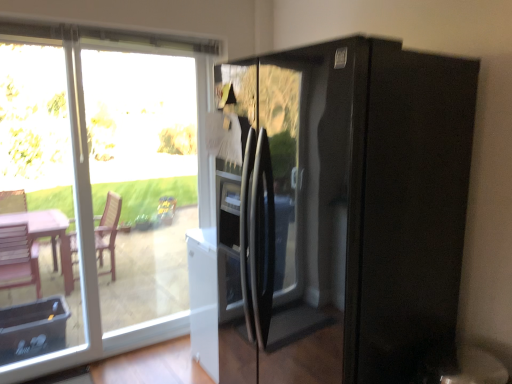
Question: From a real-world perspective, is transparent glass window at upper left physically located above or below transparent glass door at left, the first glass door from the left?

Choices:
 (A) below
 (B) above

Answer: (A)

Question: Choose the correct answer: Is transparent glass window at upper left inside transparent glass door at left, the first glass door from the left, or outside it?

Choices:
 (A) outside
 (B) inside

Answer: (A)

Question: Considering the real-world distances, which object is farthest from the transparent glass door at left, which appears as the 2th glass door when viewed from the left?

Choices:
 (A) black glass refrigerator at right
 (B) transparent glass window at upper left
 (C) transparent glass door at left, the first glass door from the left

Answer: (A)

Question: Based on their relative distances, which object is nearer to the transparent glass door at left, which is the first glass door from right to left?

Choices:
 (A) black glass refrigerator at right
 (B) transparent glass door at left, the second glass door in the right-to-left sequence
 (C) transparent glass window at upper left

Answer: (C)